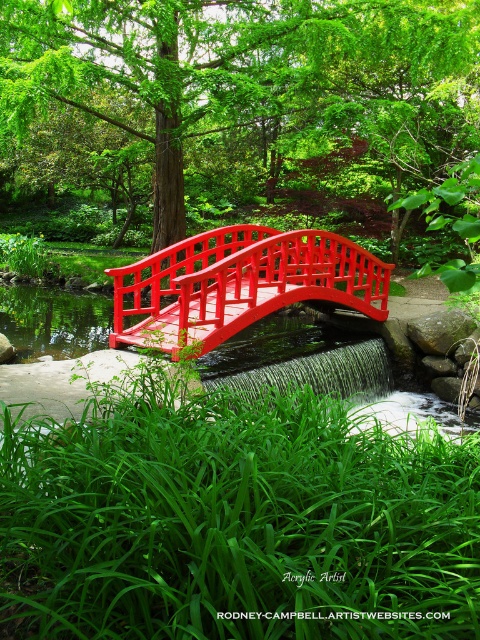
In the scene shown: You are a photographer positioned at the center of the image. You want to capture a closeup of the glossy wooden bridge at center. Based on its position, which direction should you aim your camera?

The glossy wooden bridge at center is located at point 0.816 on the x axis and 0.485 on the y axis, so you should aim your camera towards the center of the image to capture it.

You are a visitor in the Japanese garden and want to cross the water using the bridges. Which bridge, the glossy wooden bridge at center or the shiny red bridge at center, is shorter and thus easier to step over if the water rises?

The glossy wooden bridge at center is shorter than the shiny red bridge at center, so it would be easier to step over if the water rises.